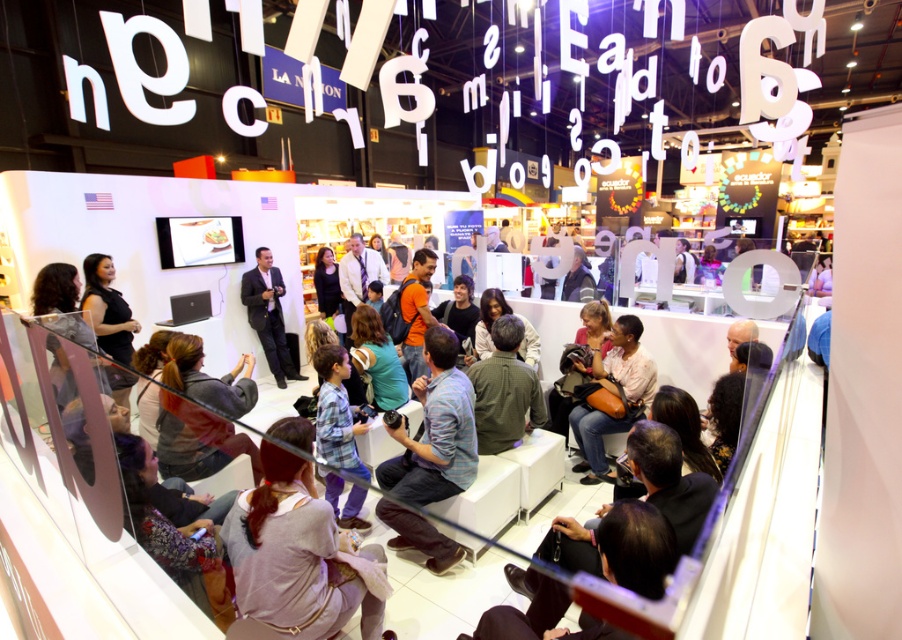
Question: Can you confirm if plaid shirt at center is bigger than leather brown handbag at center?

Choices:
 (A) yes
 (B) no

Answer: (A)

Question: Which is nearer to the plaid shirt at center?

Choices:
 (A) black suit at center
 (B) leather brown handbag at center

Answer: (B)

Question: Which object is closer to the camera taking this photo?

Choices:
 (A) leather brown handbag at center
 (B) plaid shirt at center
 (C) black suit at center

Answer: (B)

Question: Observing the image, what is the correct spatial positioning of leather brown handbag at center in reference to black suit at center?

Choices:
 (A) right
 (B) left

Answer: (A)

Question: Which object is farther from the camera taking this photo?

Choices:
 (A) plaid shirt at center
 (B) black suit at center

Answer: (B)

Question: Does plaid shirt at center appear on the right side of leather brown handbag at center?

Choices:
 (A) yes
 (B) no

Answer: (B)